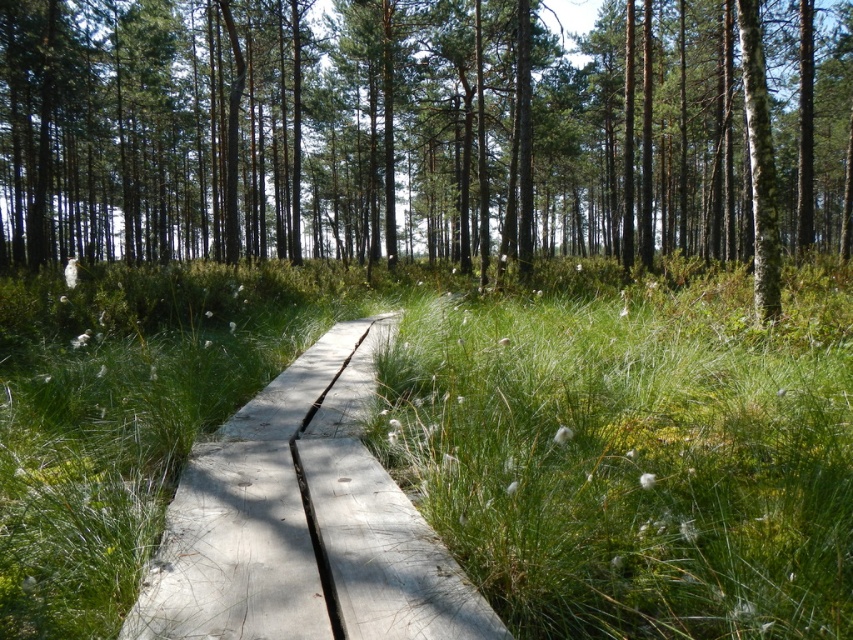
You are standing on the light gray wooden path at center and want to step onto the green grassy at center. Which direction should you move to reach it?

You should move to the right to reach the green grassy at center since it is located to the right of the light gray wooden path at center.

You are standing on the wooden boardwalk in the forest scene. There is a green grassy area marked by the point at coordinates (460, 436). Can you walk directly towards this point from your current position on the boardwalk?

The green grassy area at center is represented by point (460, 436). Since the boardwalk is between parallel planks and the grassy area is at the center, you cannot walk directly towards the point as it is likely between the boardwalk planks where there might be no solid ground to walk on.

You are a hiker trying to cross the light gray wooden path at center. There is a brown wood tree at center nearby. Do you think the tree is wider than the path?

The brown wood tree at center might be wider than the light gray wooden path at center, so there is a possibility that the tree is wider than the path.